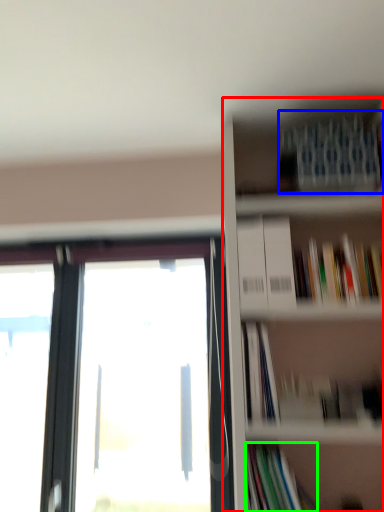
Question: Considering the real-world distances, which object is farthest from bookcase (highlighted by a red box)? book (highlighted by a blue box) or book (highlighted by a green box)?

Choices:
 (A) book
 (B) book

Answer: (B)